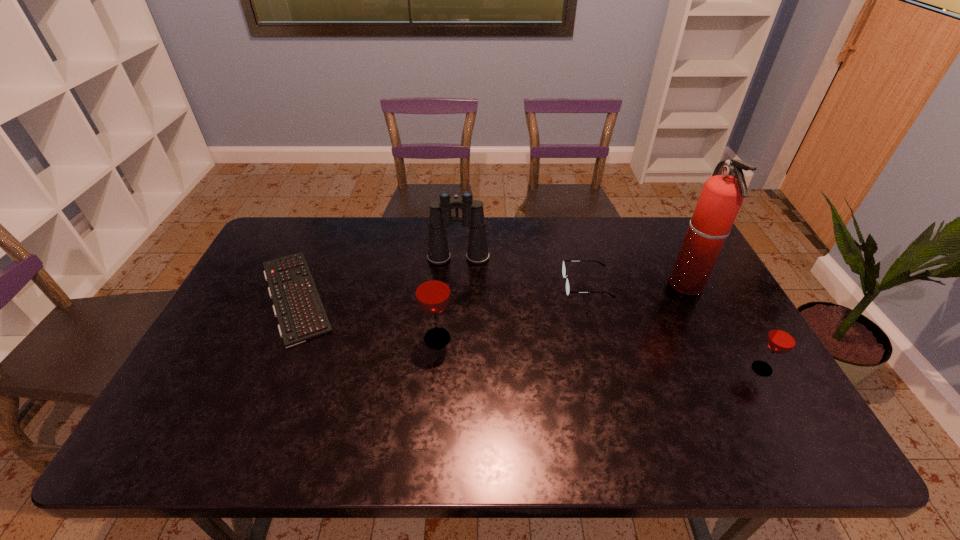
The height and width of the screenshot is (540, 960). What are the coordinates of `vacant area at the right edge of the desktop` in the screenshot? It's located at (701, 298).

At what (x,y) coordinates should I click in order to perform the action: click on vacant region at the far left corner. Please return your answer as a coordinate pair (x, y). Looking at the image, I should click on (283, 230).

This screenshot has height=540, width=960. I want to click on empty space between the tallest object and the binoculars, so click(573, 272).

The width and height of the screenshot is (960, 540). Identify the location of vacant area that lies between the second object from right to left and the second shortest object. (636, 285).

Locate an element on the screen. The width and height of the screenshot is (960, 540). vacant space in between the leftmost object and the tallest object is located at coordinates (492, 291).

Where is `vacant area that lies between the binoculars and the second shortest object`? The height and width of the screenshot is (540, 960). vacant area that lies between the binoculars and the second shortest object is located at coordinates (522, 271).

The width and height of the screenshot is (960, 540). I want to click on free spot between the fire extinguisher and the farther glass, so click(563, 312).

This screenshot has width=960, height=540. What are the coordinates of `free space between the shortest object and the binoculars` in the screenshot? It's located at (377, 277).

Find the location of a particular element. This screenshot has height=540, width=960. vacant area between the leftmost object and the taller glass is located at coordinates (367, 317).

Locate an element on the screen. This screenshot has width=960, height=540. free point between the second object from right to left and the fourth object from left to right is located at coordinates (636, 285).